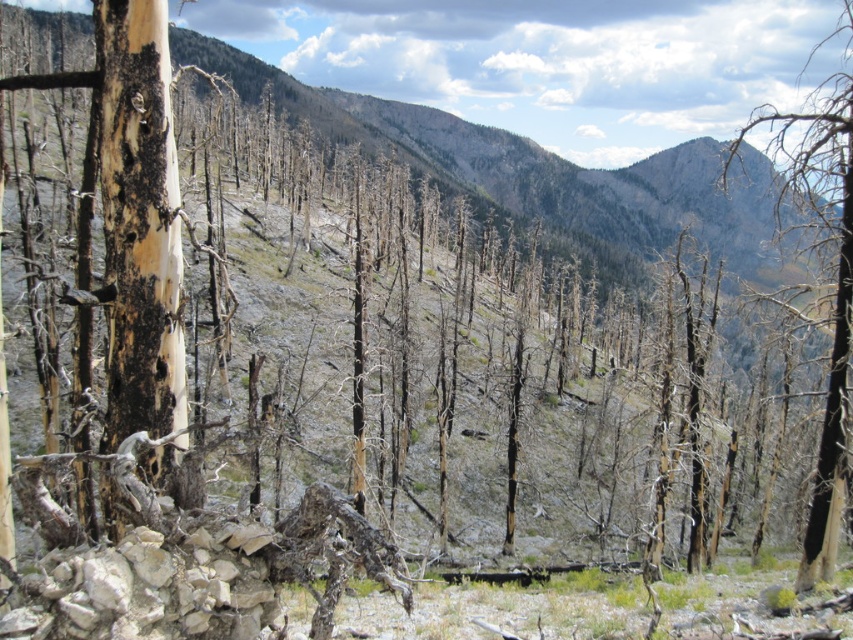
In the scene shown: You are a firefighter assessing the damage after a wildfire. You notice two trees in the scene, the charcoal textured tree trunk at left and the charred wood tree at right. Which tree is taller?

The charcoal textured tree trunk at left has a lesser height compared to the charred wood tree at right, so the charred wood tree at right is taller.